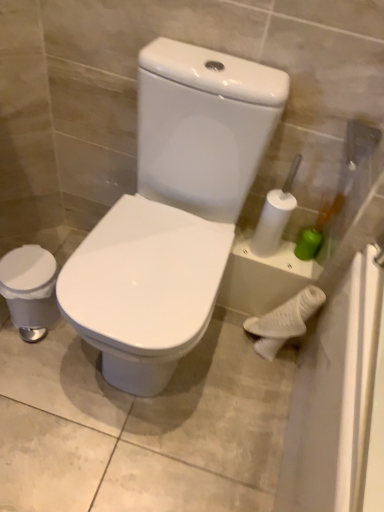
I want to click on vacant space in front of white glossy toilet at center, arranged as the 2th porcelain when viewed from the right, so click(127, 441).